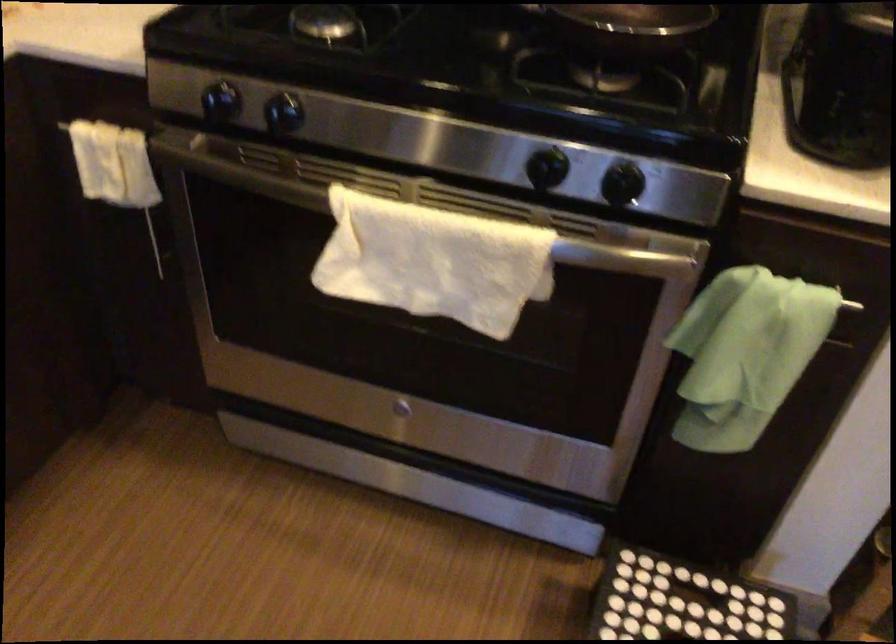
Locate an element on the screen. oven drawer handle is located at coordinates (618, 257).